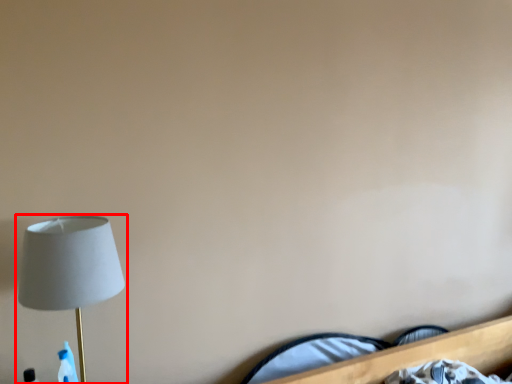
Question: From the image's perspective, what is the correct spatial relationship of lamp (annotated by the red box) in relation to bed?

Choices:
 (A) below
 (B) above

Answer: (B)